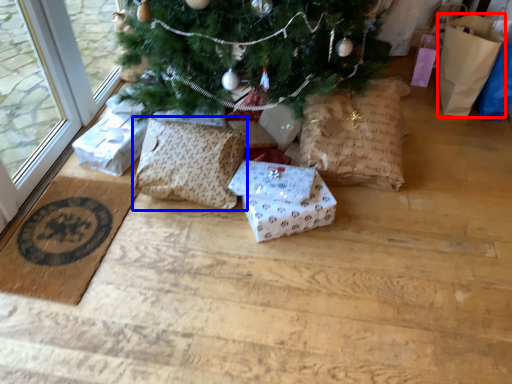
Question: Which of the following is the closest to the observer, gift bag (highlighted by a red box) or pillow (highlighted by a blue box)?

Choices:
 (A) gift bag
 (B) pillow

Answer: (B)